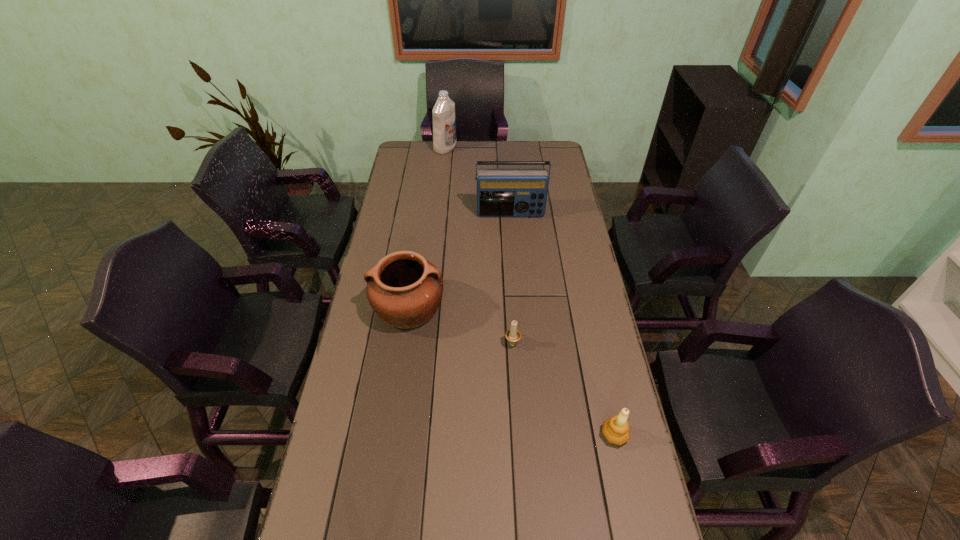
The image size is (960, 540). In order to click on free point at the far edge in this screenshot , I will do `click(470, 153)`.

Image resolution: width=960 pixels, height=540 pixels. What are the coordinates of `vacant area at the left edge of the desktop` in the screenshot? It's located at (385, 382).

Locate an element on the screen. Image resolution: width=960 pixels, height=540 pixels. blank area at the right edge is located at coordinates (560, 167).

Where is `empty location between the second tallest object and the pottery`? The width and height of the screenshot is (960, 540). empty location between the second tallest object and the pottery is located at coordinates (460, 261).

This screenshot has width=960, height=540. Identify the location of vacant area that lies between the pottery and the fourth tallest object. click(x=512, y=372).

Find the location of a particular element. free spot between the radio receiver and the pottery is located at coordinates click(460, 261).

Locate an element on the screen. This screenshot has width=960, height=540. vacant area that lies between the nearest object and the detergent is located at coordinates pos(530,292).

Locate an element on the screen. Image resolution: width=960 pixels, height=540 pixels. vacant region between the radio receiver and the third shortest object is located at coordinates (460, 261).

I want to click on unoccupied area between the farther candle_holder and the nearer candle_holder, so click(x=564, y=388).

Find the location of a particular element. The height and width of the screenshot is (540, 960). object identified as the second closest to the fourth nearest object is located at coordinates (444, 121).